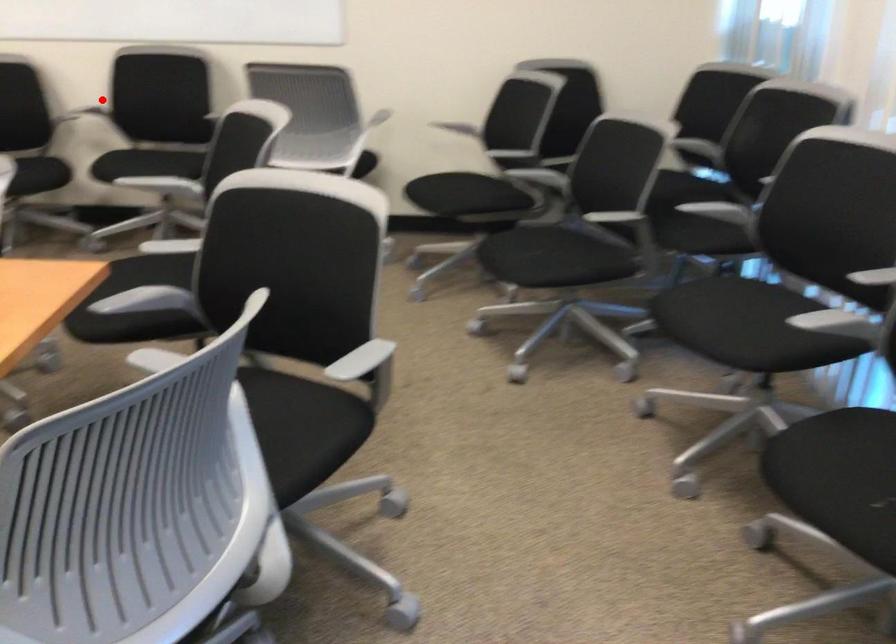
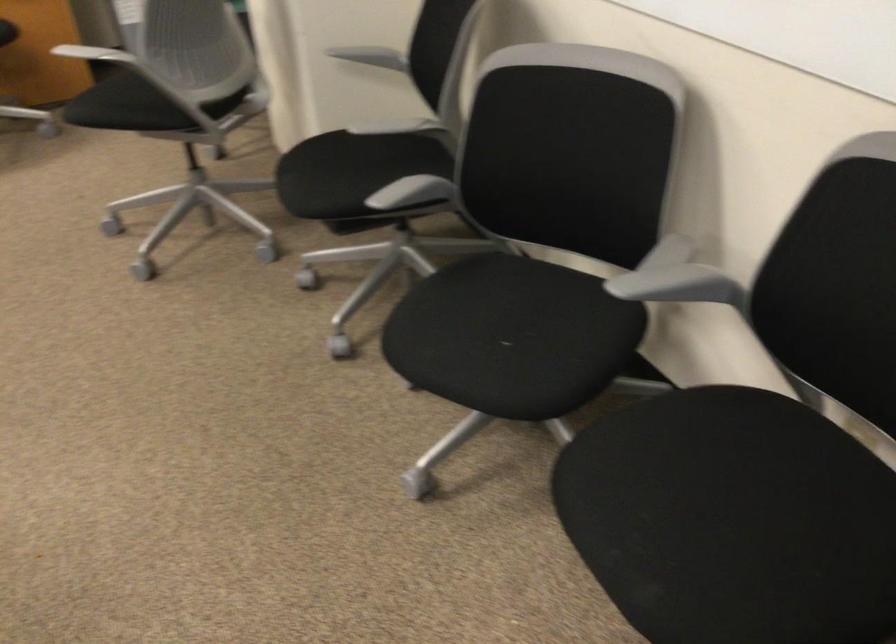
Question: I am providing you with two images of the same scene from different viewpoints. Given a red point in image1, look at the same physical point in image2. Is it:

Choices:
 (A) Closer to the viewpoint
 (B) Farther from the viewpoint

Answer: (A)